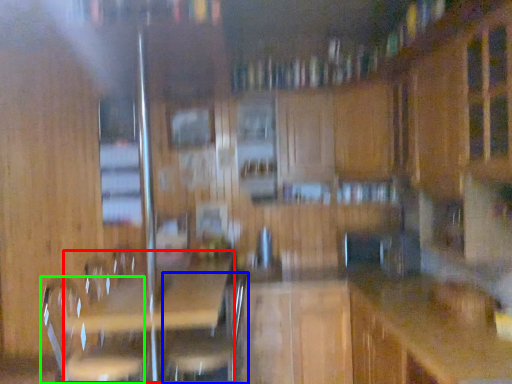
Question: Considering the real-world distances, which object is farthest from picnic table (highlighted by a red box)? swivel chair (highlighted by a blue box) or swivel chair (highlighted by a green box)?

Choices:
 (A) swivel chair
 (B) swivel chair

Answer: (B)